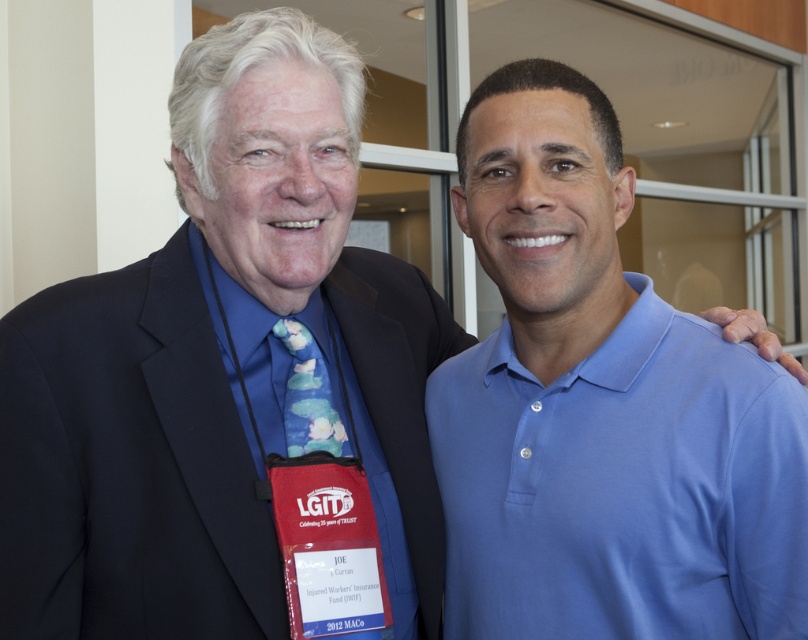
Question: Does dark blue fabric business suit at left appear under blue cotton shirt at left?

Choices:
 (A) no
 (B) yes

Answer: (B)

Question: Where is blue smooth polo shirt at right located in relation to blue floral tie at center in the image?

Choices:
 (A) left
 (B) right

Answer: (B)

Question: Is blue cotton shirt at left above blue floral tie at center?

Choices:
 (A) yes
 (B) no

Answer: (B)

Question: Which object is positioned closest to the dark blue fabric business suit at left?

Choices:
 (A) blue smooth polo shirt at right
 (B) blue floral tie at center

Answer: (B)

Question: Which point appears closest to the camera in this image?

Choices:
 (A) (107, 522)
 (B) (323, 448)

Answer: (A)

Question: Which of these objects is positioned farthest from the blue smooth polo shirt at right?

Choices:
 (A) dark blue fabric business suit at left
 (B) blue floral tie at center
 (C) blue cotton shirt at left

Answer: (B)